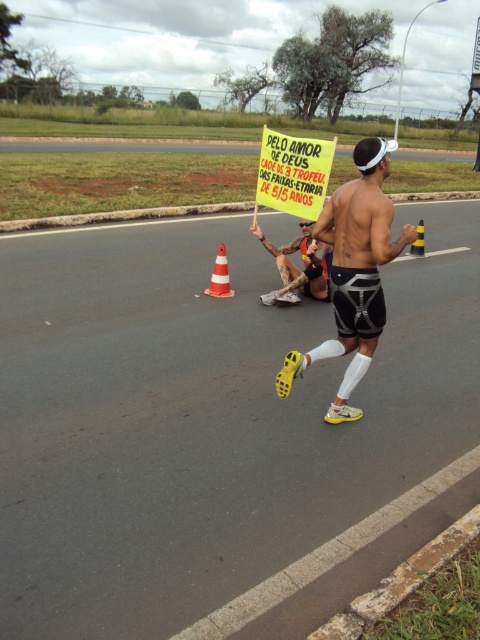
Where is `yellow paper sign at center`? The width and height of the screenshot is (480, 640). yellow paper sign at center is located at coordinates (294, 172).

Is yellow paper sign at center positioned in front of yellow/black striped cone at center-right?

Yes, yellow paper sign at center is in front of yellow/black striped cone at center-right.

What are the coordinates of `yellow paper sign at center` in the screenshot? It's located at (294, 172).

Which is below, yellow paper sign at center or orange striped traffic cone at center?

orange striped traffic cone at center

Which is behind, point (285, 211) or point (223, 266)?

The point (223, 266) is more distant.

You are a GUI agent. You are given a task and a screenshot of the screen. Output one action in this format:
    pyautogui.click(x=<x>, y=<y>)
    Task: Click on the yellow paper sign at center
    
    Given the screenshot: What is the action you would take?
    pyautogui.click(x=294, y=172)

Between point (367, 339) and point (415, 244), which one is positioned behind?

The point (415, 244) is more distant.

Can you confirm if matte yellow sign at right is taller than yellow/black striped cone at center-right?

Yes, matte yellow sign at right is taller than yellow/black striped cone at center-right.

Where is `matte yellow sign at right`? The image size is (480, 640). matte yellow sign at right is located at coordinates (354, 273).